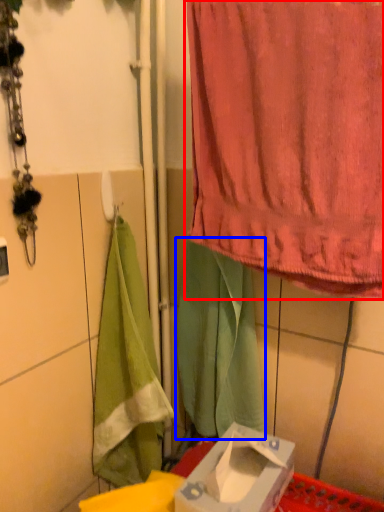
Question: Which point is further to the camera, curtain (highlighted by a red box) or cloth (highlighted by a blue box)?

Choices:
 (A) curtain
 (B) cloth

Answer: (B)